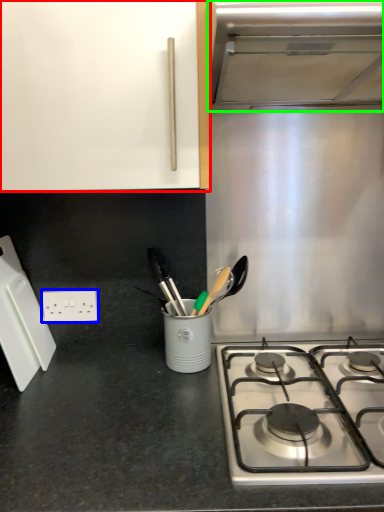
Question: Considering the real-world distances, which object is farthest from cabinetry (highlighted by a red box)? electric outlet (highlighted by a blue box) or vent (highlighted by a green box)?

Choices:
 (A) electric outlet
 (B) vent

Answer: (A)